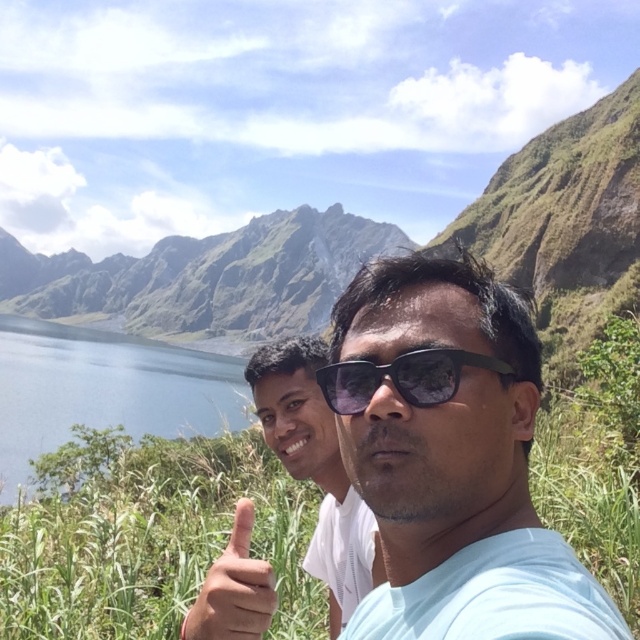
Question: Which point is farther from the camera taking this photo?

Choices:
 (A) (440, 378)
 (B) (272, 246)
 (C) (188, 538)
 (D) (156, 396)

Answer: (B)

Question: Is light skin tone flesh at center smaller than sunglasses at center?

Choices:
 (A) yes
 (B) no

Answer: (B)

Question: Among these points, which one is farthest from the camera?

Choices:
 (A) (266, 296)
 (B) (324, 269)

Answer: (B)

Question: Can you confirm if blue glassy water at left is bigger than sunglasses at center?

Choices:
 (A) no
 (B) yes

Answer: (B)

Question: Is green grassy mountain at upper center smaller than green leafy grass at lower left?

Choices:
 (A) yes
 (B) no

Answer: (B)

Question: Among these objects, which one is farthest from the camera?

Choices:
 (A) green grassy mountain at upper center
 (B) green leafy grass at center
 (C) blue glassy water at left

Answer: (A)